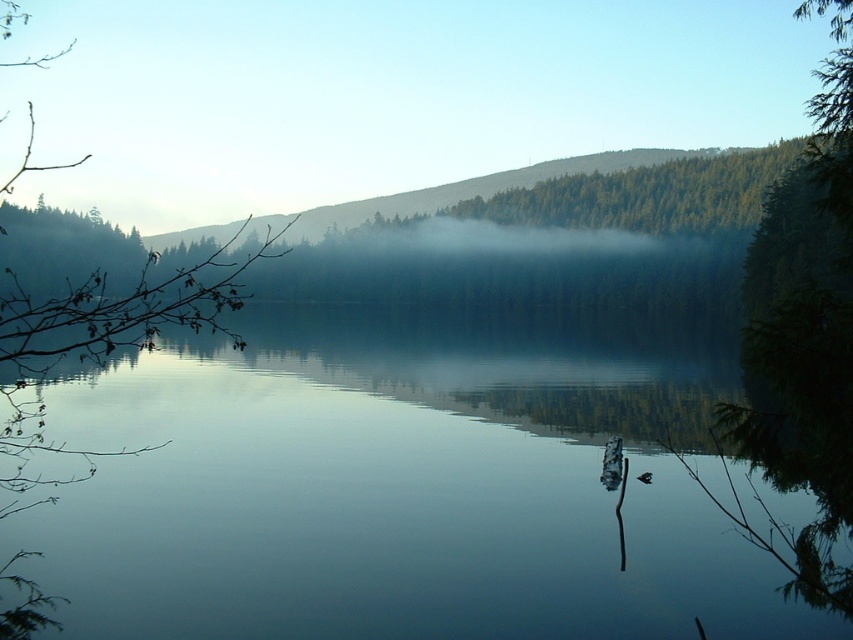
Question: Is transparent water at center thinner than green matte branch at left?

Choices:
 (A) yes
 (B) no

Answer: (A)

Question: Can you confirm if transparent water at center is positioned above green matte branch at left?

Choices:
 (A) no
 (B) yes

Answer: (A)

Question: Which point is closer to the camera?

Choices:
 (A) transparent water at center
 (B) green matte branch at left

Answer: (B)

Question: From the image, what is the correct spatial relationship of transparent water at center in relation to green matte branch at left?

Choices:
 (A) below
 (B) above

Answer: (A)

Question: Which object is closer to the camera taking this photo?

Choices:
 (A) transparent water at center
 (B) green matte branch at left

Answer: (B)